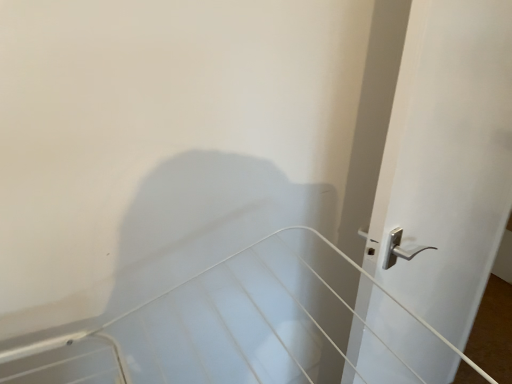
Describe the element at coordinates (447, 161) in the screenshot. This screenshot has width=512, height=384. I see `white glossy door at right` at that location.

Where is `white glossy door at right`? The height and width of the screenshot is (384, 512). white glossy door at right is located at coordinates (447, 161).

Identify the location of white glossy door at right. The height and width of the screenshot is (384, 512). (447, 161).